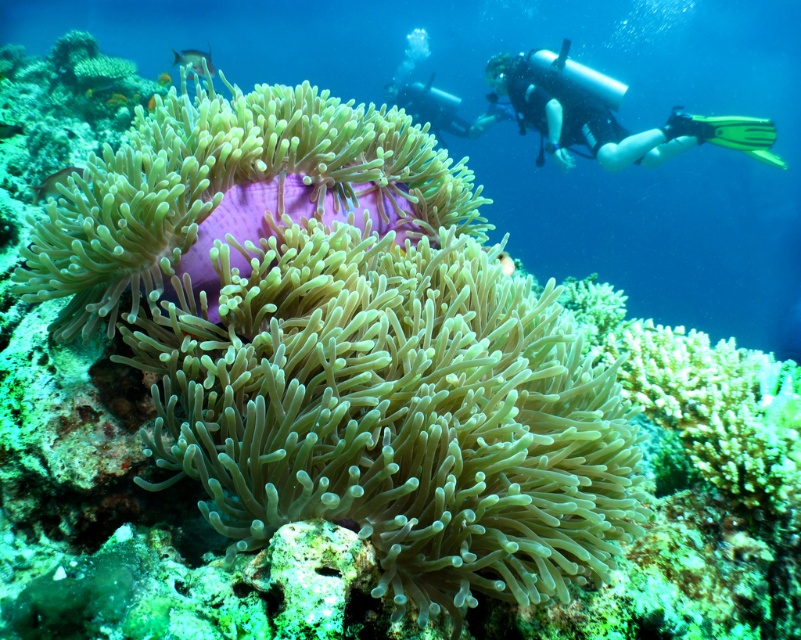
Is green soft coral at center thinner than orange matte fish at center?

Incorrect, green soft coral at center's width is not less than orange matte fish at center's.

Is green soft coral at center taller than orange matte fish at center?

In fact, green soft coral at center may be shorter than orange matte fish at center.

Identify the location of green soft coral at center. (393, 412).

Is shiny blue fish at upper left bigger than orange matte fish at center?

No.

This screenshot has height=640, width=801. Describe the element at coordinates (115, 99) in the screenshot. I see `shiny blue fish at upper left` at that location.

The image size is (801, 640). What are the coordinates of `shiny blue fish at upper left` in the screenshot? It's located at (115, 99).

Can you confirm if translucent green coral at center is positioned above orange matte fish at center?

Actually, translucent green coral at center is below orange matte fish at center.

Who is more distant from viewer, (x=509, y=269) or (x=153, y=102)?

Point (x=509, y=269)

You are a GUI agent. You are given a task and a screenshot of the screen. Output one action in this format:
    pyautogui.click(x=<x>, y=<y>)
    Task: Click on the translucent green coral at center
    The height and width of the screenshot is (640, 801).
    Given the screenshot: What is the action you would take?
    pyautogui.click(x=505, y=262)